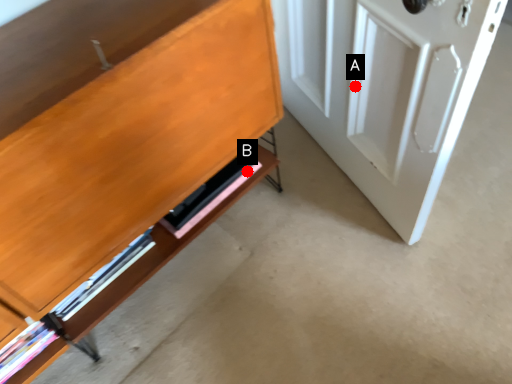
Question: Two points are circled on the image, labeled by A and B beside each circle. Which point is closer to the camera?

Choices:
 (A) A is closer
 (B) B is closer

Answer: (A)